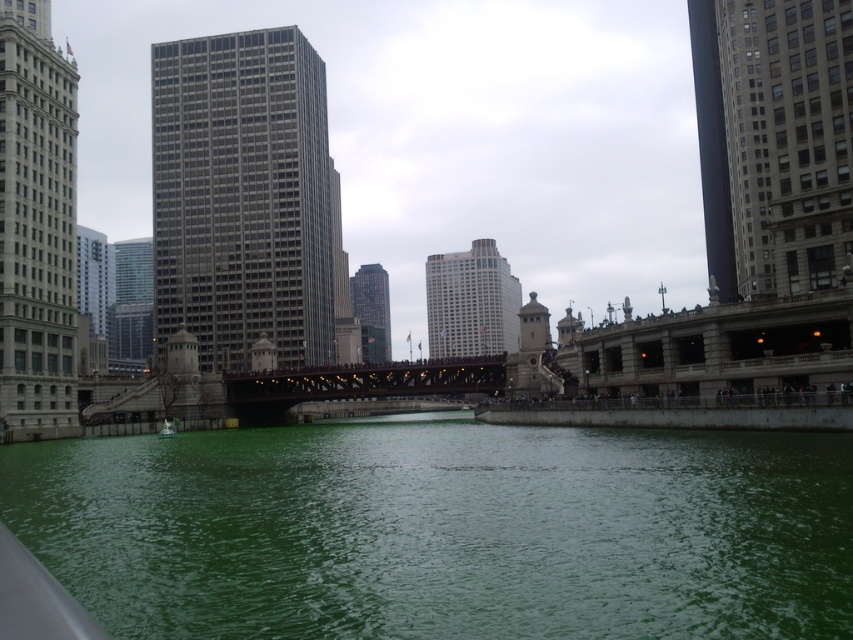
The width and height of the screenshot is (853, 640). What do you see at coordinates (471, 301) in the screenshot? I see `smooth glass skyscraper at center` at bounding box center [471, 301].

Does point (512, 300) come behind point (376, 292)?

No, it is in front of (376, 292).

I want to click on smooth glass skyscraper at center, so click(471, 301).

Does point (769, 45) come farther from viewer compared to point (508, 349)?

No, it is in front of (508, 349).

In the scene shown: Does gray stone skyscraper at upper right have a smaller size compared to smooth glass skyscraper at center?

Correct, gray stone skyscraper at upper right occupies less space than smooth glass skyscraper at center.

What do you see at coordinates (773, 140) in the screenshot?
I see `gray stone skyscraper at upper right` at bounding box center [773, 140].

Where is `gray stone skyscraper at upper right`? The image size is (853, 640). gray stone skyscraper at upper right is located at coordinates 773,140.

Is white stone tower at left behind smooth glass skyscraper at center?

No, it is not.

Is point (18, 179) positioned after point (451, 301)?

No, it is not.

The width and height of the screenshot is (853, 640). What are the coordinates of `white stone tower at left` in the screenshot? It's located at (36, 225).